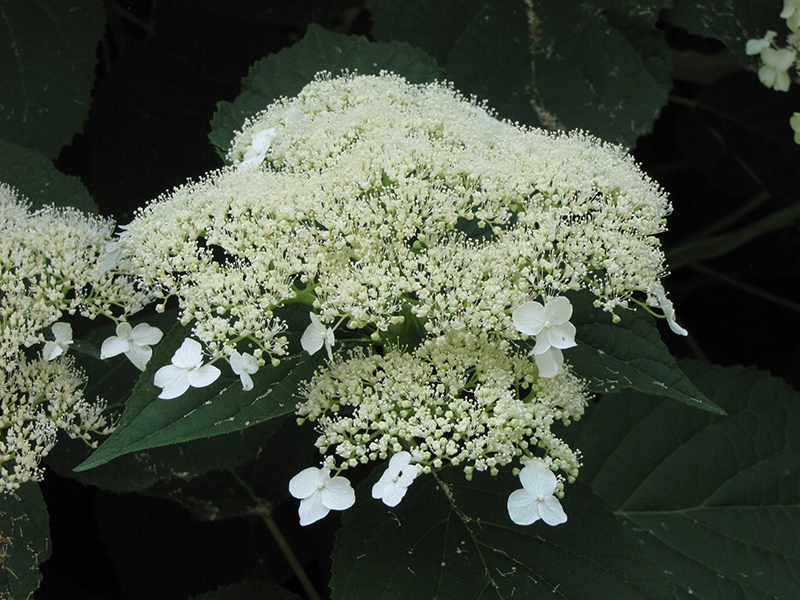
I want to click on white plant, so click(x=404, y=290).